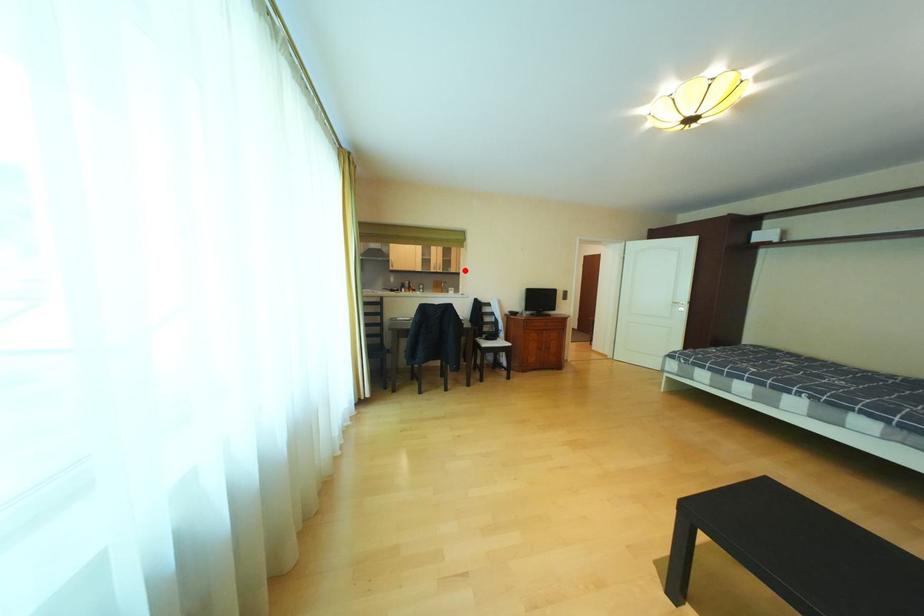
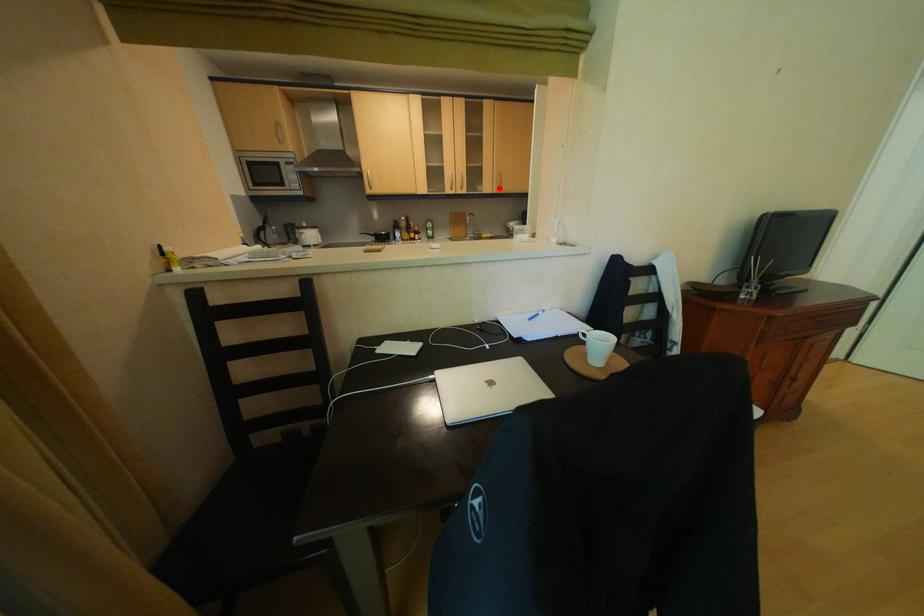
I am providing you with two images of the same scene from different viewpoints. A red point is marked on the first image and another point is marked on the second image. Are the points marked in image1 and image2 representing the same 3D position?

Yes